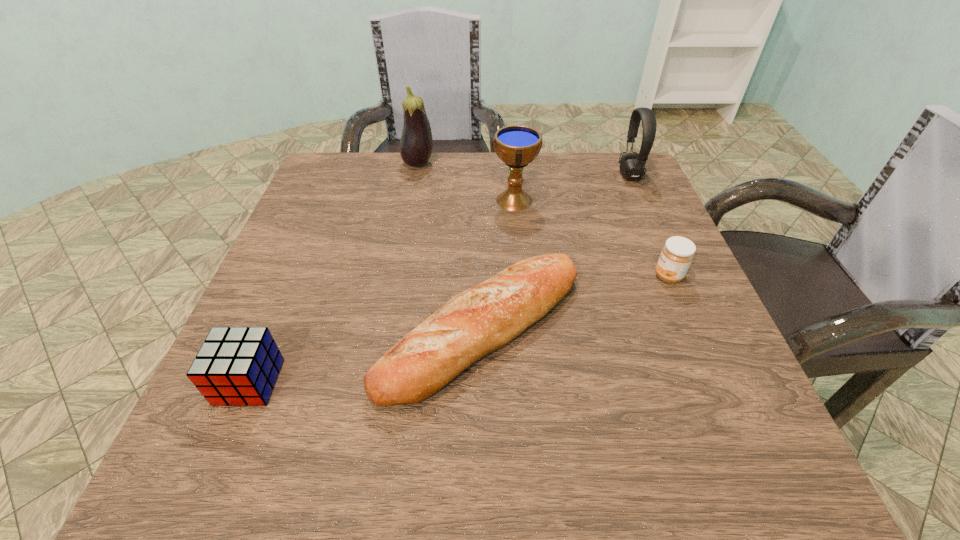
What are the coordinates of `vacant space located 0.090m on the right of the chalice` in the screenshot? It's located at (573, 200).

This screenshot has height=540, width=960. Identify the location of vacant region located on the right of the baguet. (674, 329).

Identify the location of vacant region located on the right of the leftmost object. This screenshot has width=960, height=540. (474, 382).

This screenshot has width=960, height=540. I want to click on free space located on the front label of the jam, so click(564, 276).

Identify the location of vacant space located on the front label of the jam. The height and width of the screenshot is (540, 960). click(x=599, y=276).

Locate an element on the screen. Image resolution: width=960 pixels, height=540 pixels. vacant point located 0.060m on the front label of the jam is located at coordinates (624, 276).

Identify the location of eggplant at the far edge. (416, 144).

The width and height of the screenshot is (960, 540). Find the location of `headset situated at the far edge`. headset situated at the far edge is located at coordinates (632, 165).

Locate an element on the screen. Image resolution: width=960 pixels, height=540 pixels. chalice present at the far edge is located at coordinates (516, 145).

Identify the location of object situated at the left edge. click(238, 366).